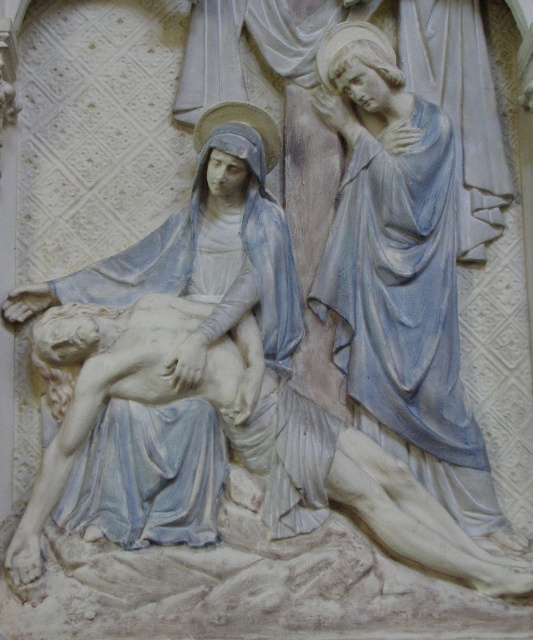
Question: Which of the following is the farthest from the observer?

Choices:
 (A) (246, 241)
 (B) (351, 244)

Answer: (B)

Question: Which of the following is the farthest from the observer?

Choices:
 (A) (424, 218)
 (B) (123, 392)

Answer: (A)

Question: Which of the following is the closest to the observer?

Choices:
 (A) (237, 332)
 (B) (375, 312)

Answer: (A)

Question: Is white marble statue at center smaller than matte stone figure at upper right?

Choices:
 (A) yes
 (B) no

Answer: (B)

Question: Is white marble statue at center to the left of matte stone figure at upper right from the viewer's perspective?

Choices:
 (A) yes
 (B) no

Answer: (A)

Question: Is white marble statue at center to the right of matte stone figure at upper right from the viewer's perspective?

Choices:
 (A) no
 (B) yes

Answer: (A)